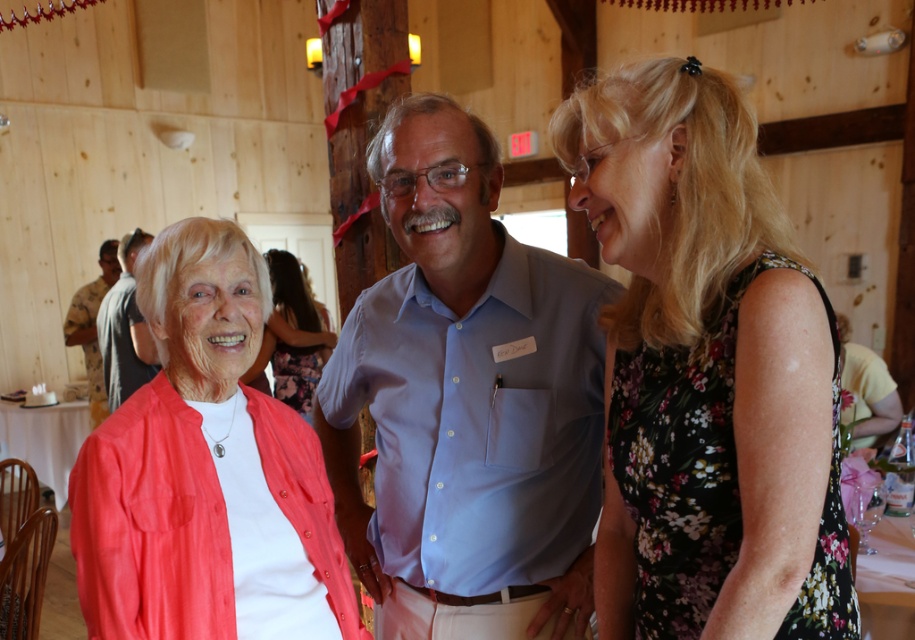
Question: Which of the following is the closest to the observer?

Choices:
 (A) floral dress at center
 (B) light blue cotton shirt at center
 (C) camouflage uniform at left
 (D) matte coral blouse at center

Answer: (A)

Question: Among these points, which one is farthest from the camera?

Choices:
 (A) (425, 499)
 (B) (109, 296)

Answer: (B)

Question: Is floral dress at center positioned behind camouflage uniform at left?

Choices:
 (A) yes
 (B) no

Answer: (B)

Question: In this image, where is light blue cotton shirt at center located relative to matte coral cardigan at center?

Choices:
 (A) below
 (B) above

Answer: (A)

Question: Does floral dress at center appear on the right side of matte coral blouse at center?

Choices:
 (A) no
 (B) yes

Answer: (B)

Question: Which object is positioned closest to the camouflage uniform at left?

Choices:
 (A) matte coral blouse at center
 (B) floral dress at center

Answer: (A)